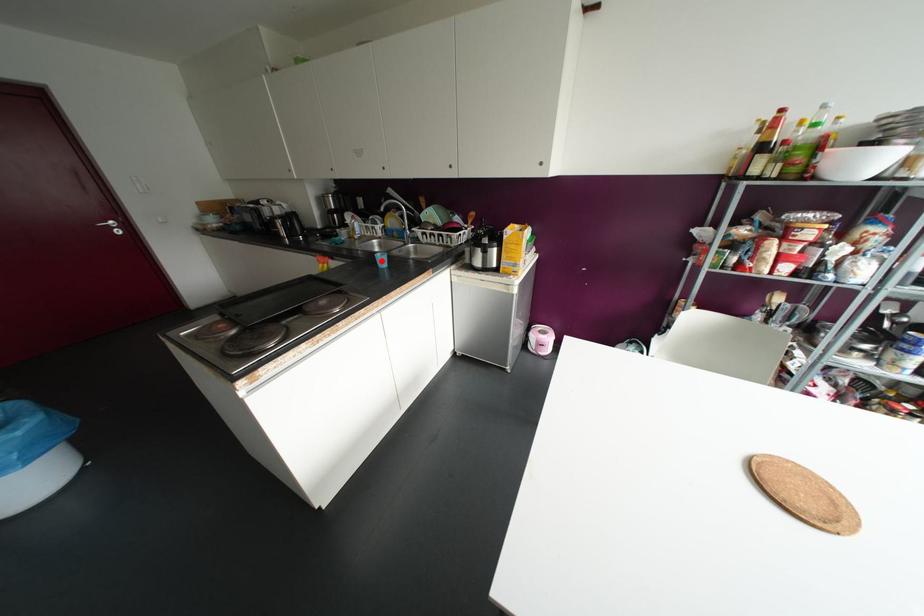
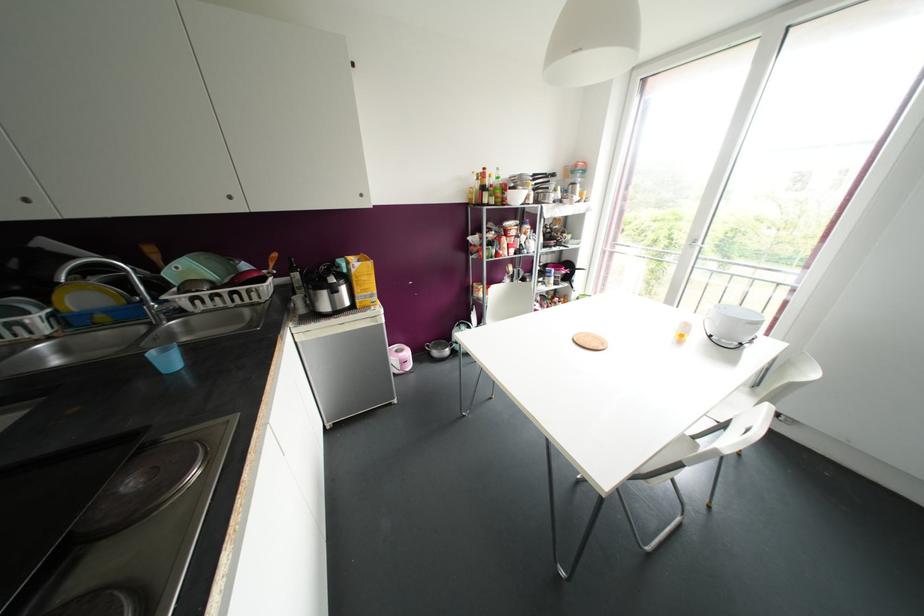
Question: I am providing you with two images of the same scene from different viewpoints. In image1, a red point is highlighted. Considering the same 3D point in image2, which of the following is correct?

Choices:
 (A) It is closer
 (B) It is farther

Answer: (B)